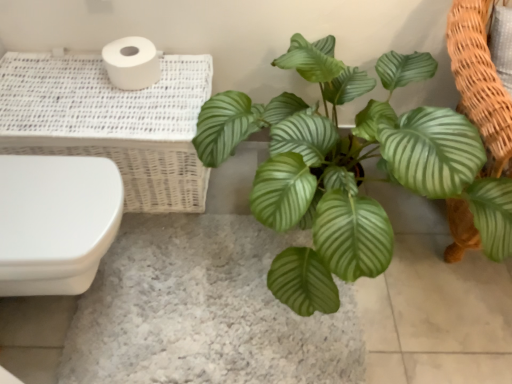
I want to click on free point above white matte toilet paper at upper left (from a real-world perspective), so click(x=129, y=50).